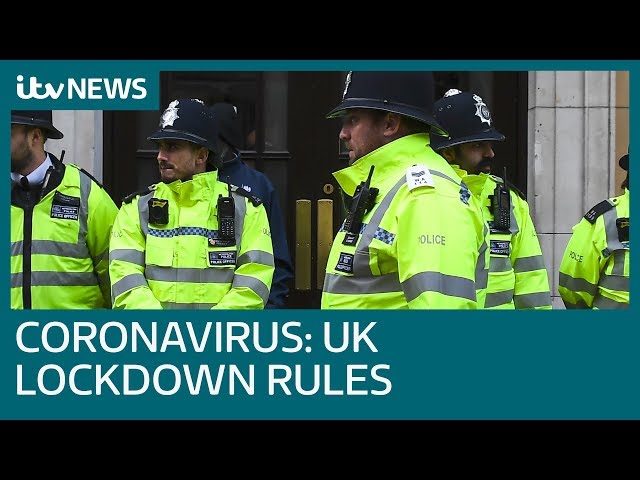
The height and width of the screenshot is (480, 640). I want to click on keyhole, so click(329, 188).